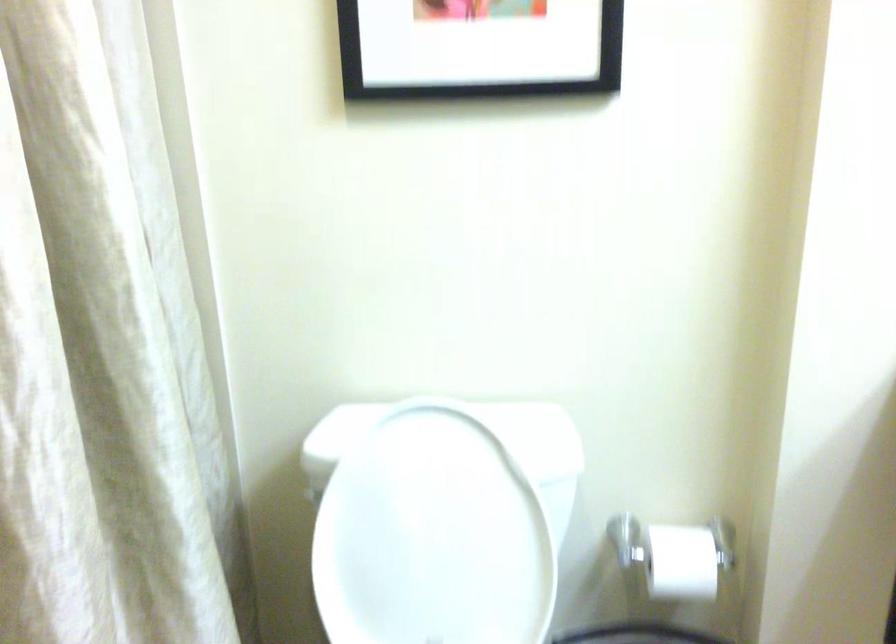
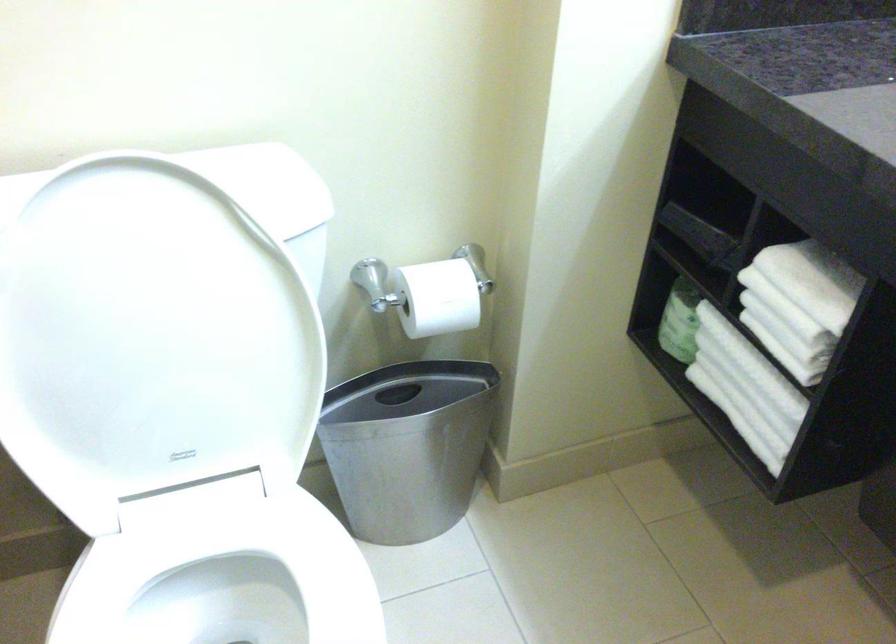
Where in the second image is the point corresponding to the point at 674,562 from the first image?

(436, 298)